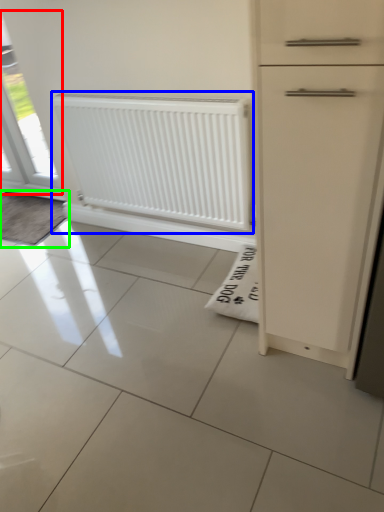
Question: Which is farther away from window (highlighted by a red box)? radiator (highlighted by a blue box) or doormat (highlighted by a green box)?

Choices:
 (A) radiator
 (B) doormat

Answer: (A)